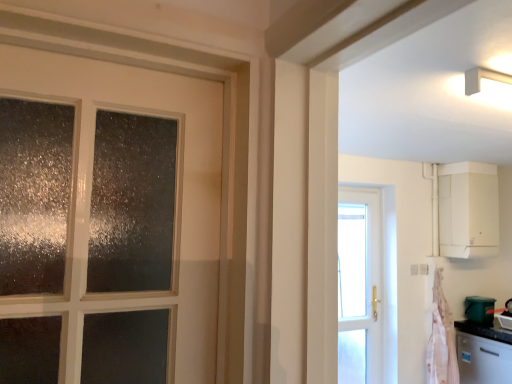
This screenshot has width=512, height=384. Describe the element at coordinates (468, 210) in the screenshot. I see `white matte cabinet at upper right` at that location.

In order to click on satin silver dishwasher at lower right in this screenshot , I will do `click(483, 359)`.

The width and height of the screenshot is (512, 384). What are the coordinates of `green plastic bucket at lower right` in the screenshot? It's located at (480, 310).

Where is `white matte cabinet at upper right`? The width and height of the screenshot is (512, 384). white matte cabinet at upper right is located at coordinates (468, 210).

From a real-world perspective, does pink fabric at right stand above satin silver dishwasher at lower right?

Yes.

Which object is further away from the camera taking this photo, pink fabric at right or satin silver dishwasher at lower right?

Positioned behind is pink fabric at right.

Is pink fabric at right inside or outside of satin silver dishwasher at lower right?

pink fabric at right cannot be found inside satin silver dishwasher at lower right.

Between point (442, 298) and point (478, 370), which one is positioned behind?

The point (442, 298) is farther.

Is there a large distance between white matte cabinet at upper right and pink fabric at right?

No, white matte cabinet at upper right is not far away from pink fabric at right.

Does white matte cabinet at upper right appear on the right side of pink fabric at right?

Indeed, white matte cabinet at upper right is positioned on the right side of pink fabric at right.

Looking at their sizes, would you say white matte cabinet at upper right is wider or thinner than pink fabric at right?

In the image, white matte cabinet at upper right appears to be wider than pink fabric at right.

Is pink fabric at right surrounded by white matte cabinet at upper right?

No.

Which is behind, point (494, 365) or point (441, 372)?

The point (441, 372) is behind.

Can you confirm if satin silver dishwasher at lower right is positioned to the left of pink fabric at right?

Incorrect, satin silver dishwasher at lower right is not on the left side of pink fabric at right.

Locate an element on the screen. curtain on the left of satin silver dishwasher at lower right is located at coordinates (441, 339).

Is satin silver dishwasher at lower right wider than pink fabric at right?

Yes, satin silver dishwasher at lower right is wider than pink fabric at right.

Is white matte cabinet at upper right positioned behind satin silver dishwasher at lower right?

Yes, white matte cabinet at upper right is further from the viewer.

Does white matte cabinet at upper right have a lesser height compared to satin silver dishwasher at lower right?

In fact, white matte cabinet at upper right may be taller than satin silver dishwasher at lower right.

Is white matte cabinet at upper right at the right side of satin silver dishwasher at lower right?

No.

Is white matte cabinet at upper right looking in the opposite direction of satin silver dishwasher at lower right?

No, white matte cabinet at upper right is not facing the opposite direction of satin silver dishwasher at lower right.

From a real-world perspective, is pink fabric at right beneath white matte cabinet at upper right?

Yes.

Is pink fabric at right turned away from white matte cabinet at upper right?

That's not correct — pink fabric at right is not looking away from white matte cabinet at upper right.

From the image's perspective, does pink fabric at right appear lower than green plastic bucket at lower right?

Indeed, from the image's perspective, pink fabric at right is shown beneath green plastic bucket at lower right.

Does point (432, 358) lie behind point (495, 301)?

No, it is not.

Does pink fabric at right have a lesser height compared to green plastic bucket at lower right?

In fact, pink fabric at right may be taller than green plastic bucket at lower right.

Is satin silver dishwasher at lower right positioned before green plastic bucket at lower right?

Yes, satin silver dishwasher at lower right is closer to the camera.

Considering the sizes of objects satin silver dishwasher at lower right and green plastic bucket at lower right in the image provided, who is shorter, satin silver dishwasher at lower right or green plastic bucket at lower right?

With less height is green plastic bucket at lower right.

Identify the location of appliance that is behind the satin silver dishwasher at lower right. (x=480, y=310).

Could you tell me if satin silver dishwasher at lower right is facing green plastic bucket at lower right?

No, satin silver dishwasher at lower right does not turn towards green plastic bucket at lower right.

This screenshot has width=512, height=384. I want to click on curtain that is behind the satin silver dishwasher at lower right, so (441, 339).

This screenshot has width=512, height=384. Identify the location of curtain beneath the white matte cabinet at upper right (from a real-world perspective). (441, 339).

Considering their positions, is green plastic bucket at lower right positioned closer to pink fabric at right than satin silver dishwasher at lower right?

satin silver dishwasher at lower right is positioned closer to the anchor pink fabric at right.

When comparing their distances from satin silver dishwasher at lower right, does white matte cabinet at upper right or pink fabric at right seem further?

white matte cabinet at upper right is positioned further to the anchor satin silver dishwasher at lower right.

Considering their positions, is white matte cabinet at upper right positioned closer to pink fabric at right than satin silver dishwasher at lower right?

satin silver dishwasher at lower right is closer to pink fabric at right.

When comparing their distances from pink fabric at right, does satin silver dishwasher at lower right or green plastic bucket at lower right seem further?

Based on the image, green plastic bucket at lower right appears to be further to pink fabric at right.

Looking at this image, from the image, which object appears to be nearer to white matte cabinet at upper right, satin silver dishwasher at lower right or pink fabric at right?

pink fabric at right lies closer to white matte cabinet at upper right than the other object.

Considering their positions, is white matte cabinet at upper right positioned closer to green plastic bucket at lower right than pink fabric at right?

Among the two, pink fabric at right is located nearer to green plastic bucket at lower right.

Looking at the image, which one is located further to satin silver dishwasher at lower right, white matte cabinet at upper right or green plastic bucket at lower right?

white matte cabinet at upper right lies further to satin silver dishwasher at lower right than the other object.

From the image, which object appears to be farther from green plastic bucket at lower right, satin silver dishwasher at lower right or white matte cabinet at upper right?

The object further to green plastic bucket at lower right is white matte cabinet at upper right.

Find the location of `appliance between white matte cabinet at upper right and satin silver dishwasher at lower right from top to bottom`. appliance between white matte cabinet at upper right and satin silver dishwasher at lower right from top to bottom is located at coordinates (480, 310).

At what (x,y) coordinates should I click in order to perform the action: click on curtain between white matte cabinet at upper right and satin silver dishwasher at lower right vertically. Please return your answer as a coordinate pair (x, y). The width and height of the screenshot is (512, 384). Looking at the image, I should click on (441, 339).

This screenshot has width=512, height=384. Find the location of `appliance located between pink fabric at right and satin silver dishwasher at lower right in the left-right direction`. appliance located between pink fabric at right and satin silver dishwasher at lower right in the left-right direction is located at coordinates (480, 310).

Locate an element on the screen. The image size is (512, 384). appliance between white matte cabinet at upper right and pink fabric at right from top to bottom is located at coordinates (480, 310).